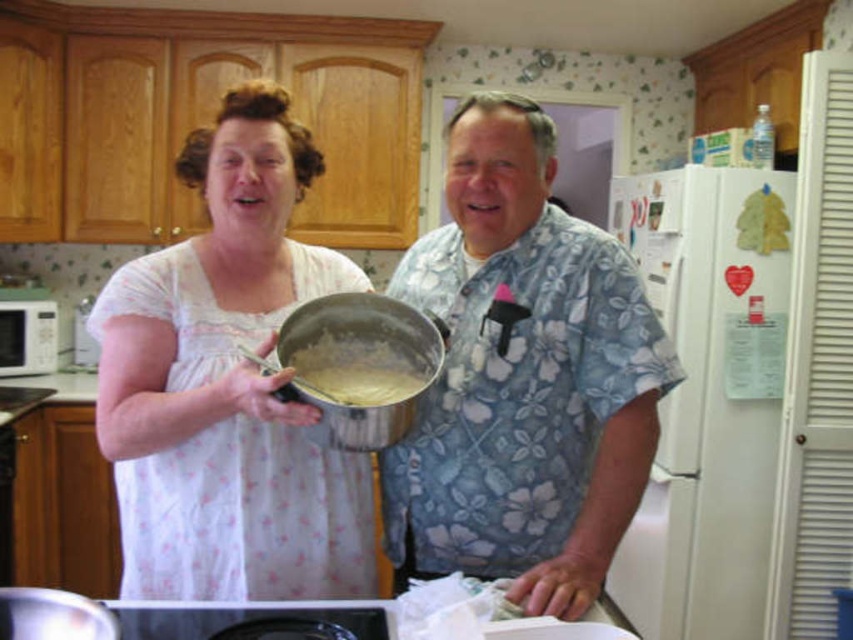
You are a home chef preparing a meal and need to place a white cotton dress at center on top of the white matte microwave at left. Can you do this without the dress falling off?

The white cotton dress at center is much taller than the white matte microwave at left, so placing it on top would cause the dress to fall off since it is taller and less stable.

You are a chef in a kitchen and need to place a 1.2 meter tall statue on the counter. The statue must be placed between the blue floral shirt at center and the white matte microwave at left. Can the statue fit in that space?

The blue floral shirt at center is taller than the white matte microwave at left, but the description does not provide information about the distance between them. Therefore, it is impossible to determine if the statue can fit in the space between them.

You are a chef who needs to reach the white matte microwave at left from your current position near the blue floral shirt at center. Is the distance between them sufficient for you to comfortably walk to the microwave without needing to move any furniture?

The distance between the blue floral shirt at center and the white matte microwave at left is 2.26 meters, which is more than enough space for a chef to comfortably walk to the microwave without needing to move any furniture.